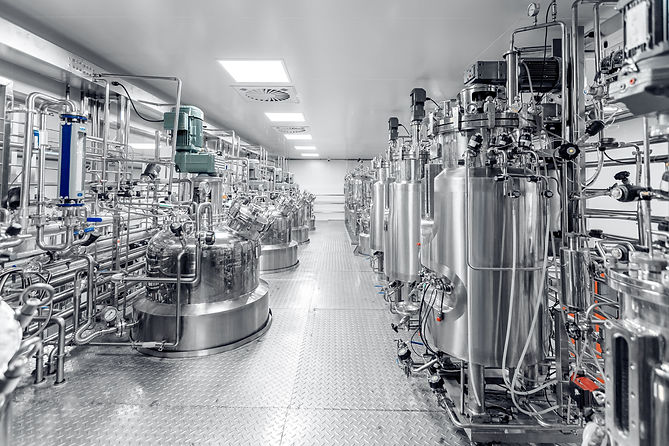
The width and height of the screenshot is (669, 446). Find the location of `floor`. floor is located at coordinates (357, 364).